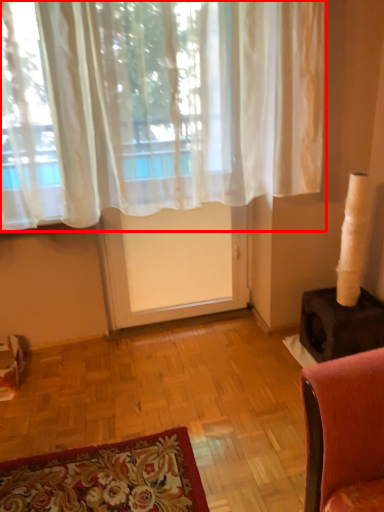
Question: From the image's perspective, where is curtain (annotated by the red box) located in relation to screen door in the image?

Choices:
 (A) above
 (B) below

Answer: (A)